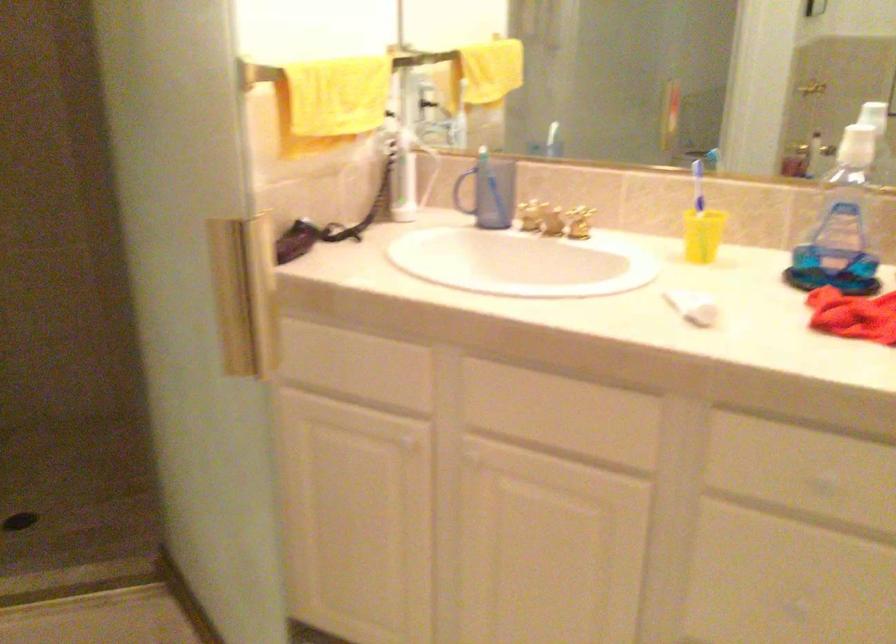
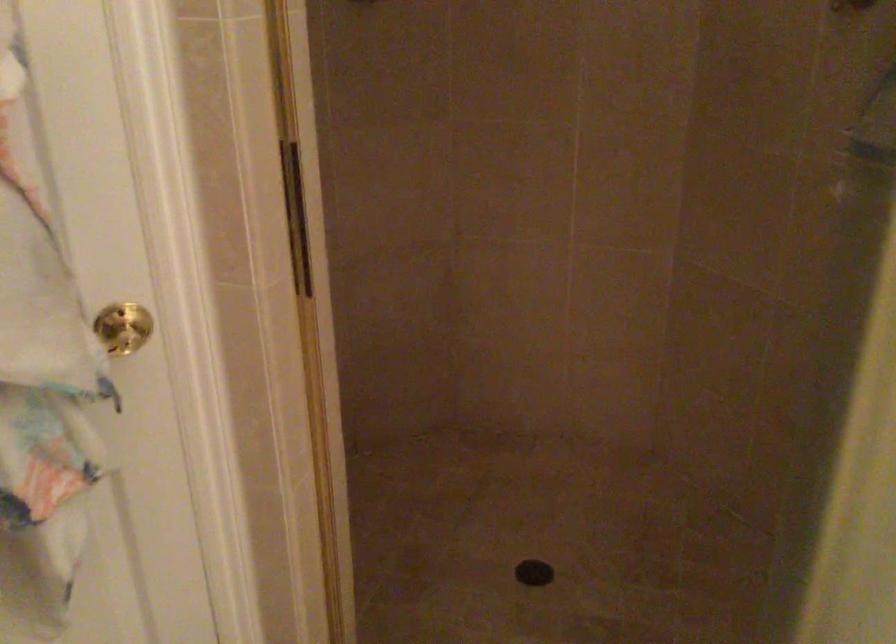
Question: The first image is from the beginning of the video and the second image is from the end. How did the camera likely rotate when shooting the video?

Choices:
 (A) Left
 (B) Right
 (C) Up
 (D) Down

Answer: (A)